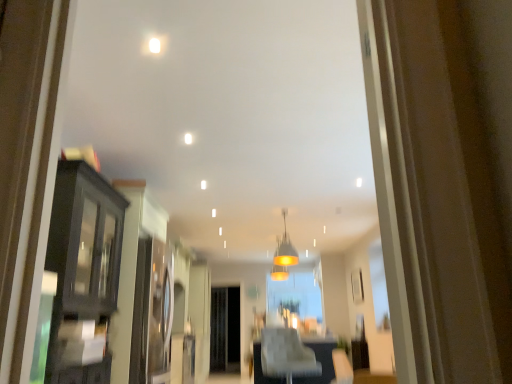
Question: Considering the relative sizes of matte black cabinet at left and matte glass pendant light at center in the image provided, is matte black cabinet at left bigger than matte glass pendant light at center?

Choices:
 (A) yes
 (B) no

Answer: (A)

Question: Does matte black cabinet at left turn towards matte glass pendant light at center?

Choices:
 (A) no
 (B) yes

Answer: (A)

Question: Is matte black cabinet at left taller than matte glass pendant light at center?

Choices:
 (A) no
 (B) yes

Answer: (B)

Question: Is matte black cabinet at left at the left side of matte glass pendant light at center?

Choices:
 (A) no
 (B) yes

Answer: (B)

Question: Is matte black cabinet at left completely or partially outside of matte glass pendant light at center?

Choices:
 (A) yes
 (B) no

Answer: (A)

Question: Is matte black cabinet at left oriented away from matte glass pendant light at center?

Choices:
 (A) yes
 (B) no

Answer: (B)

Question: From the image's perspective, is matte glass pendant light at center under matte black cabinet at left?

Choices:
 (A) no
 (B) yes

Answer: (A)

Question: Can we say matte glass pendant light at center lies outside matte black cabinet at left?

Choices:
 (A) no
 (B) yes

Answer: (B)

Question: From the image's perspective, is matte glass pendant light at center above matte black cabinet at left?

Choices:
 (A) no
 (B) yes

Answer: (B)

Question: Is matte glass pendant light at center taller than matte black cabinet at left?

Choices:
 (A) no
 (B) yes

Answer: (A)

Question: Is matte glass pendant light at center further to the viewer compared to matte black cabinet at left?

Choices:
 (A) no
 (B) yes

Answer: (B)

Question: Would you say matte glass pendant light at center contains matte black cabinet at left?

Choices:
 (A) no
 (B) yes

Answer: (A)

Question: Is matte black cabinet at left at the right side of white leather chair at center?

Choices:
 (A) yes
 (B) no

Answer: (B)